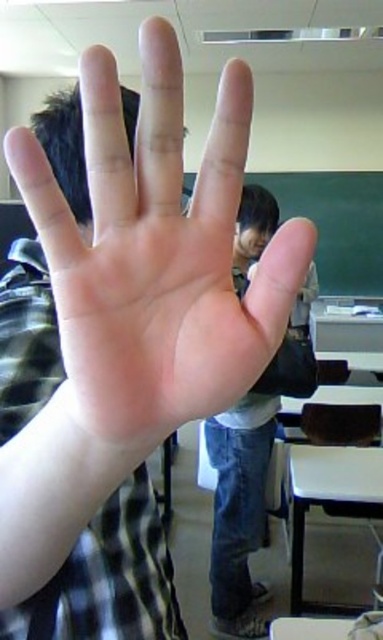
Who is more distant from viewer, [1,291] or [253,426]?

The point [253,426] is more distant.

Does point (286, 285) lie behind point (222, 625)?

No, (286, 285) is closer to viewer.

Where is `smooth skin palm at center`? smooth skin palm at center is located at coordinates (145, 262).